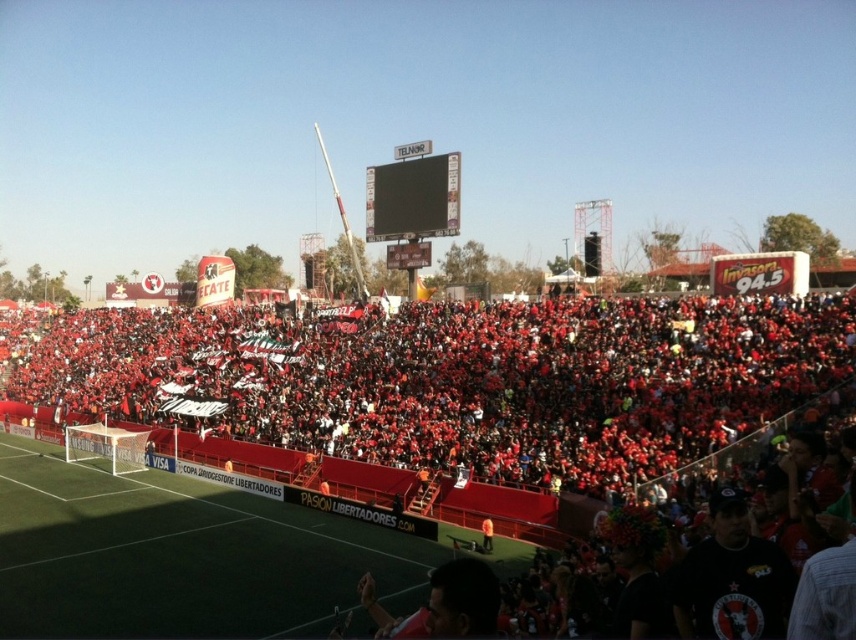
You are a photographer standing at the edge of the soccer stadium, and you want to take a photo of both the point at coordinates point (435, 200) and point (485, 534). Which point should you focus on first to ensure both are in focus?

You should focus on point (435, 200) first because it is closer to the camera than point (485, 534). By focusing on the closer point, the depth of field will likely include the farther point as well, ensuring both are in focus.

You are standing at the edge of the soccer field and want to reach a specific point marked at coordinates point (788,401). If your maximum comfortable walking distance is 50 meters, can you comfortably walk to that point?

The distance of point (788,401) from viewer is 49.36 meters, so yes, you can comfortably walk to that point as it is within your 50 meters limit.